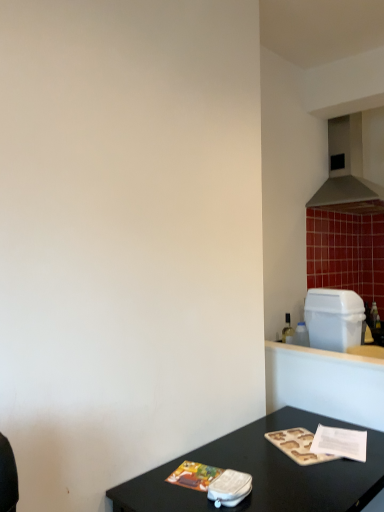
Question: Is black glossy table at lower right surrounded by white plastic trash can at right?

Choices:
 (A) no
 (B) yes

Answer: (A)

Question: Can you confirm if white plastic trash can at right is wider than black glossy table at lower right?

Choices:
 (A) yes
 (B) no

Answer: (B)

Question: Is white plastic trash can at right oriented towards black glossy table at lower right?

Choices:
 (A) yes
 (B) no

Answer: (B)

Question: From the image's perspective, is white plastic trash can at right above black glossy table at lower right?

Choices:
 (A) yes
 (B) no

Answer: (A)

Question: From the image's perspective, does white plastic trash can at right appear lower than black glossy table at lower right?

Choices:
 (A) no
 (B) yes

Answer: (A)

Question: From a real-world perspective, is white plastic trash can at right under black glossy table at lower right?

Choices:
 (A) yes
 (B) no

Answer: (B)

Question: Is metallic gray exhaust hood at upper right smaller than black glossy table at lower right?

Choices:
 (A) no
 (B) yes

Answer: (A)

Question: Considering the relative sizes of metallic gray exhaust hood at upper right and black glossy table at lower right in the image provided, is metallic gray exhaust hood at upper right taller than black glossy table at lower right?

Choices:
 (A) yes
 (B) no

Answer: (A)

Question: Is metallic gray exhaust hood at upper right at the right side of black glossy table at lower right?

Choices:
 (A) no
 (B) yes

Answer: (B)

Question: Considering the relative sizes of metallic gray exhaust hood at upper right and black glossy table at lower right in the image provided, is metallic gray exhaust hood at upper right bigger than black glossy table at lower right?

Choices:
 (A) yes
 (B) no

Answer: (A)

Question: From a real-world perspective, is metallic gray exhaust hood at upper right under black glossy table at lower right?

Choices:
 (A) no
 (B) yes

Answer: (A)

Question: Can you confirm if metallic gray exhaust hood at upper right is shorter than black glossy table at lower right?

Choices:
 (A) yes
 (B) no

Answer: (B)

Question: Is metallic gray exhaust hood at upper right surrounding white plastic trash can at right?

Choices:
 (A) yes
 (B) no

Answer: (B)